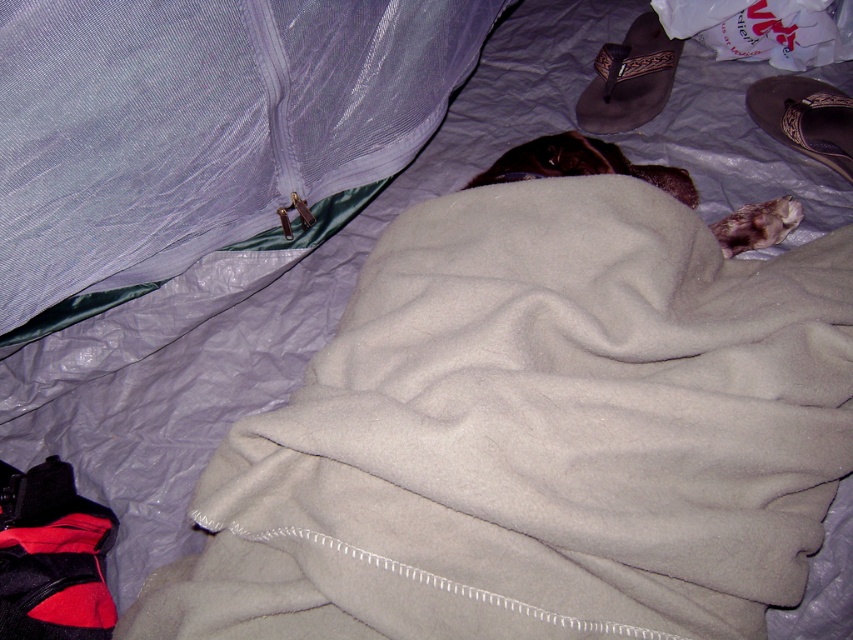
Question: Can you confirm if translucent purple fabric at upper left is positioned below fuzzy brown cat at center?

Choices:
 (A) no
 (B) yes

Answer: (A)

Question: Which object appears closest to the camera in this image?

Choices:
 (A) translucent purple fabric at upper left
 (B) fuzzy brown cat at center

Answer: (A)

Question: Is translucent purple fabric at upper left smaller than fuzzy brown cat at center?

Choices:
 (A) no
 (B) yes

Answer: (A)

Question: Can you confirm if translucent purple fabric at upper left is wider than fuzzy brown cat at center?

Choices:
 (A) yes
 (B) no

Answer: (A)

Question: Which object appears closest to the camera in this image?

Choices:
 (A) translucent purple fabric at upper left
 (B) fuzzy brown cat at center

Answer: (A)

Question: Which point is closer to the camera taking this photo?

Choices:
 (A) (245, 99)
 (B) (648, 172)

Answer: (A)